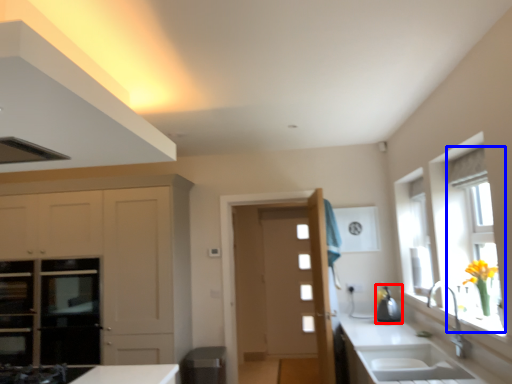
Question: Among these objects, which one is farthest to the camera, appliance (highlighted by a red box) or window (highlighted by a blue box)?

Choices:
 (A) appliance
 (B) window

Answer: (A)